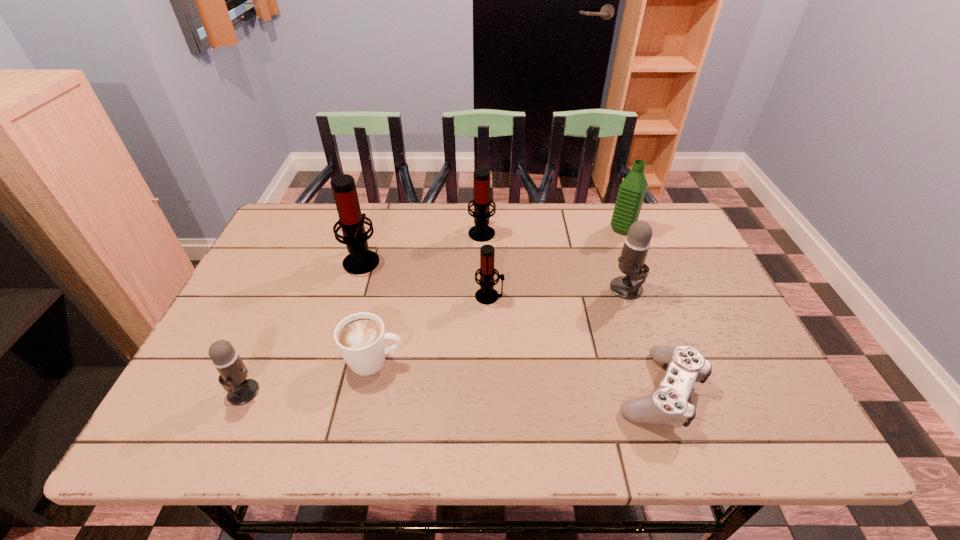
Where is `white cappuccino`? Image resolution: width=960 pixels, height=540 pixels. white cappuccino is located at coordinates (361, 339).

What are the coordinates of `cappuccino` in the screenshot? It's located at pos(361,339).

What are the coordinates of `white control` in the screenshot? It's located at (668, 405).

This screenshot has height=540, width=960. In order to click on control in this screenshot , I will do `click(668, 405)`.

The image size is (960, 540). I want to click on free space located on the back of the second farthest red microphone, so click(376, 213).

Where is `vacant space located on the front of the water bottle`? The image size is (960, 540). vacant space located on the front of the water bottle is located at coordinates (643, 284).

Locate an element on the screen. Image resolution: width=960 pixels, height=540 pixels. vacant area located 0.370m on the right of the farthest microphone is located at coordinates (615, 232).

At what (x,y) coordinates should I click in order to perform the action: click on free space located 0.270m on the left of the right gray microphone. Please return your answer as a coordinate pair (x, y). Looking at the image, I should click on (509, 289).

This screenshot has height=540, width=960. In order to click on vacant space located 0.060m on the front of the smallest red microphone in this screenshot , I will do `click(490, 322)`.

The height and width of the screenshot is (540, 960). I want to click on vacant area located 0.390m on the right of the nearest microphone, so click(441, 392).